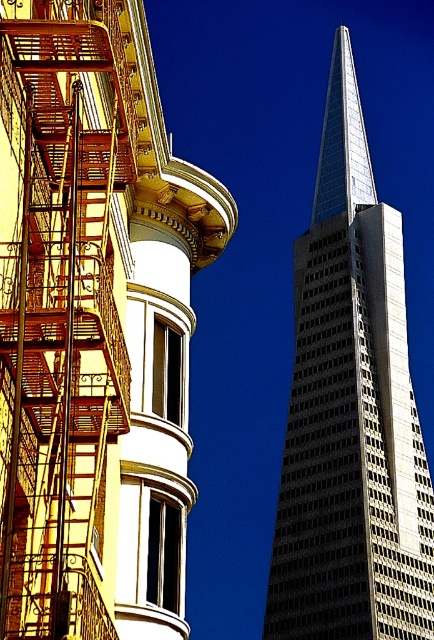
Question: Which object appears farthest from the camera in this image?

Choices:
 (A) rusty metal fire escape at left
 (B) glassy silver skyscraper at center

Answer: (B)

Question: Among these objects, which one is farthest from the camera?

Choices:
 (A) rusty metal fire escape at left
 (B) glassy silver skyscraper at center

Answer: (B)

Question: Is rusty metal fire escape at left below glassy silver skyscraper at center?

Choices:
 (A) yes
 (B) no

Answer: (A)

Question: Is rusty metal fire escape at left above glassy silver skyscraper at center?

Choices:
 (A) yes
 (B) no

Answer: (B)

Question: Which point appears closest to the camera in this image?

Choices:
 (A) (63, 272)
 (B) (303, 324)

Answer: (A)

Question: From the image, what is the correct spatial relationship of rusty metal fire escape at left in relation to glassy silver skyscraper at center?

Choices:
 (A) left
 (B) right

Answer: (A)